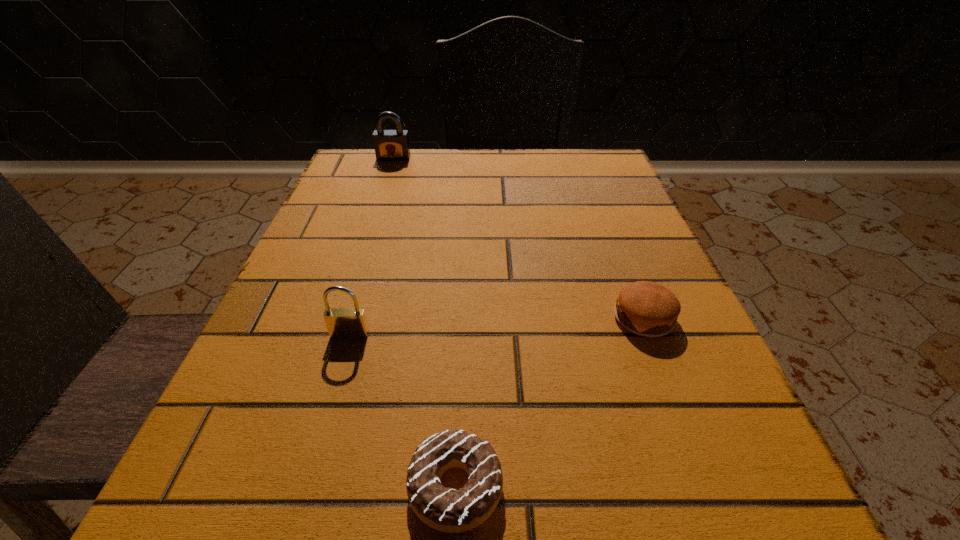
Find the location of a particular element. Image resolution: width=960 pixels, height=540 pixels. free spot at the far right corner of the desktop is located at coordinates (593, 157).

Identify the location of vacant space that's between the second shortest object and the farther padlock. This screenshot has width=960, height=540. (518, 238).

Locate an element on the screen. This screenshot has width=960, height=540. vacant space in between the second shortest object and the farthest object is located at coordinates (518, 238).

This screenshot has width=960, height=540. In order to click on free point between the shorter padlock and the rightmost object in this screenshot , I will do `click(497, 326)`.

You are a GUI agent. You are given a task and a screenshot of the screen. Output one action in this format:
    pyautogui.click(x=<x>, y=<y>)
    Task: Click on the free area in between the shorter padlock and the second object from right to left
    
    Given the screenshot: What is the action you would take?
    pyautogui.click(x=402, y=411)

You are a GUI agent. You are given a task and a screenshot of the screen. Output one action in this format:
    pyautogui.click(x=<x>, y=<y>)
    Task: Click on the free space between the taller padlock and the nearest object
    This screenshot has width=960, height=540.
    Given the screenshot: What is the action you would take?
    pyautogui.click(x=424, y=322)

Find the location of a particular element. This screenshot has width=960, height=540. free space between the farther padlock and the shorter padlock is located at coordinates (372, 246).

Locate an element on the screen. free space between the third tallest object and the third object from left to right is located at coordinates (550, 403).

Identify the location of vacant area that lies between the shorter padlock and the third tallest object. The image size is (960, 540). (497, 326).

At what (x,y) coordinates should I click in order to perform the action: click on vacant point located between the tallest object and the nearer padlock. Please return your answer as a coordinate pair (x, y). This screenshot has height=540, width=960. Looking at the image, I should click on (372, 246).